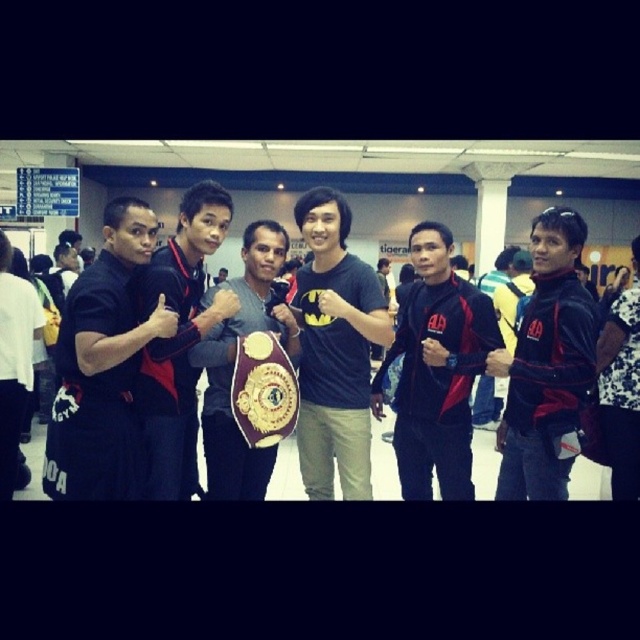
You are a photographer trying to capture a detailed shot of both the black fabric pants at left and the matte black shirt at center. Since you want to ensure both are clearly visible, which object should you focus on first to account for their sizes?

The black fabric pants at left is wider than the matte black shirt at center, so you should focus on the black fabric pants at left first to ensure its larger size is properly captured.

You are a photographer at the event and need to ensure the matte black jacket at center and the matte black jacket at right are visible in the photo. Given their sizes, which jacket will appear bigger in the final photo?

The matte black jacket at center will appear bigger in the final photo because it is larger in size than the matte black jacket at right.